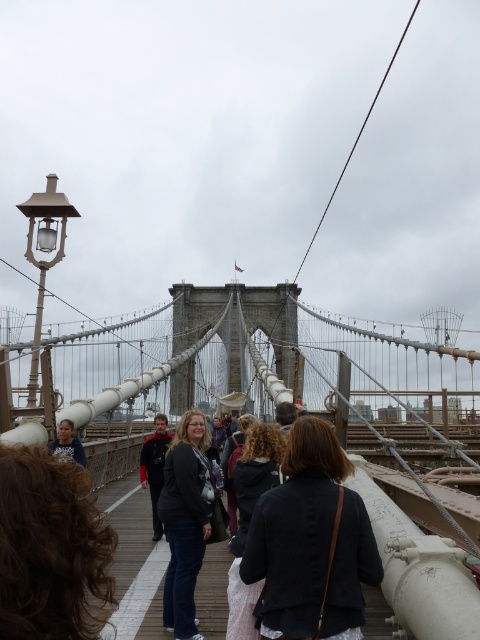
In the scene shown: Who is positioned more to the right, dark blue jacket at center or dark gray fabric jacket at center?

Result: Positioned to the right is dark blue jacket at center.

Locate an element on the screen. dark blue jacket at center is located at coordinates (311, 541).

This screenshot has height=640, width=480. I want to click on dark blue jacket at center, so click(311, 541).

Locate an element on the screen. Image resolution: width=480 pixels, height=640 pixels. dark blue jacket at center is located at coordinates (311, 541).

Is dark gray fabric jacket at center shorter than matte black jacket at left?

Indeed, dark gray fabric jacket at center has a lesser height compared to matte black jacket at left.

Who is lower down, dark gray fabric jacket at center or matte black jacket at left?

dark gray fabric jacket at center

This screenshot has width=480, height=640. What do you see at coordinates (134, 561) in the screenshot?
I see `dark gray fabric jacket at center` at bounding box center [134, 561].

What are the coordinates of `dark gray fabric jacket at center` in the screenshot? It's located at (134, 561).

Which is behind, point (271, 529) or point (165, 422)?

Positioned behind is point (165, 422).

Can you confirm if dark blue jacket at center is thinner than dark brown leather jacket at center?

No, dark blue jacket at center is not thinner than dark brown leather jacket at center.

Which is in front, point (348, 531) or point (141, 484)?

Point (348, 531) is in front.

Locate an element on the screen. The image size is (480, 640). dark blue jacket at center is located at coordinates (311, 541).